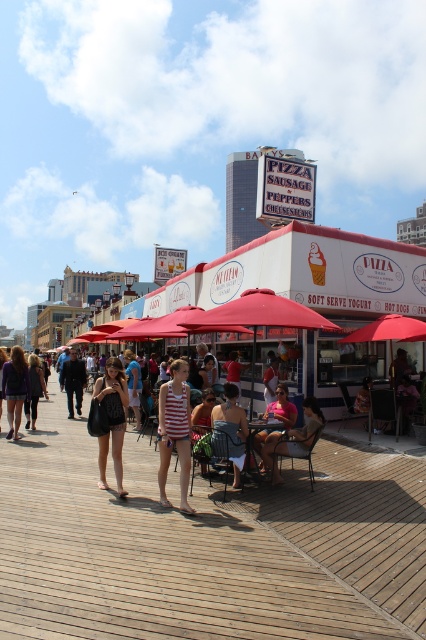
What are the coordinates of the striped fabric shorts at center?

The striped fabric shorts at center are located at coordinates point (175,432).

You are a tourist standing on the boardwalk and see the wooden at center and the striped tank top at center. Which object is closer to your right side?

The wooden at center is closer to your right side because it is positioned to the right of the striped tank top at center.